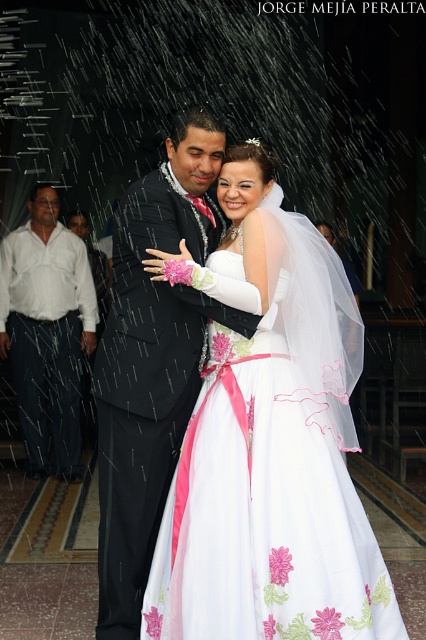
You are a photographer at the wedding. You want to capture a photo where the white satin dress at center is clearly visible without being blocked by the white cotton shirt at left. Is this possible based on their current positions?

Yes, because the white satin dress at center is in front of the white cotton shirt at left, so it won not be blocked and will be clearly visible.

What is the object located at the coordinates point (264, 509) in the image?

The object located at point (264, 509) is the white satin dress at center.